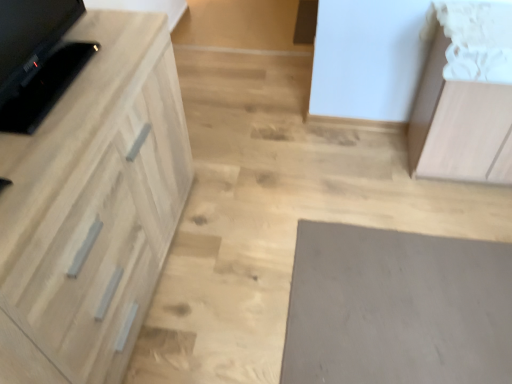
Where is `free space above gray matte mat at lower right (from a real-world perspective)`? The image size is (512, 384). free space above gray matte mat at lower right (from a real-world perspective) is located at coordinates (417, 339).